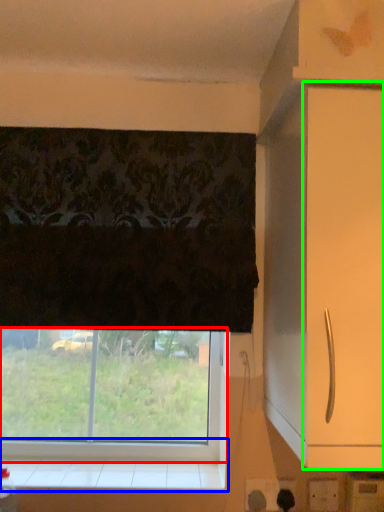
Question: Which is nearer to the window (highlighted by a red box)? window sill (highlighted by a blue box) or screen door (highlighted by a green box).

Choices:
 (A) window sill
 (B) screen door

Answer: (A)